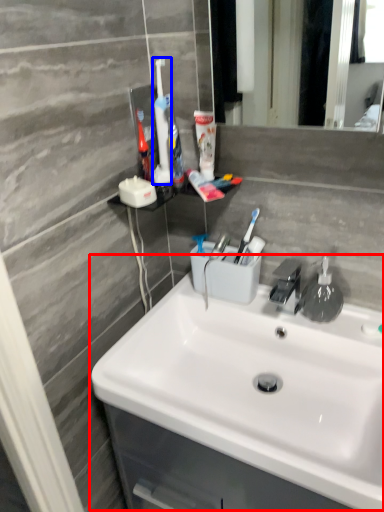
Question: Which object appears closest to the camera in this image, sink (highlighted by a red box) or toothbrush (highlighted by a blue box)?

Choices:
 (A) sink
 (B) toothbrush

Answer: (A)